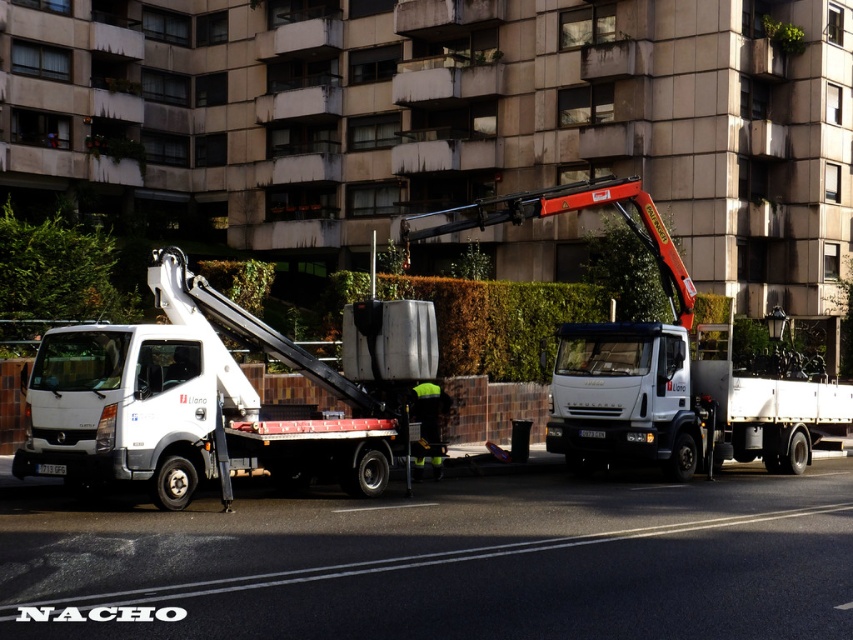
Based on the photo, you are a delivery driver trying to park your truck between the white matte truck at left and the white glossy tow truck at center. Given that your truck is 2.5 meters wide, can you safely fit your truck in the space between them?

The white matte truck at left is thinner than the white glossy tow truck at center, but without knowing the exact width of the space between them, it is impossible to determine if your truck can fit safely.

You are a delivery driver who needs to park your 6 meter long truck between the white matte truck at left and the other truck on the right. Is there enough space between them to park your truck without overlapping either vehicle?

The distance between the white matte truck at left and the other truck on the right is 11.99 meters. Since your truck is only 6 meters long, there is sufficient space to park between them without overlapping either vehicle.

You are a delivery driver who needs to back up your truck into the parking space between the white matte truck at left and the white matte truck at center. Based on their positions, which truck should you align your truck closer to when entering the space to ensure proper parking?

You should align your truck closer to the white matte truck at center because the white matte truck at left is positioned to the left of the white matte truck at center, meaning there is more space available on the right side near the center truck.